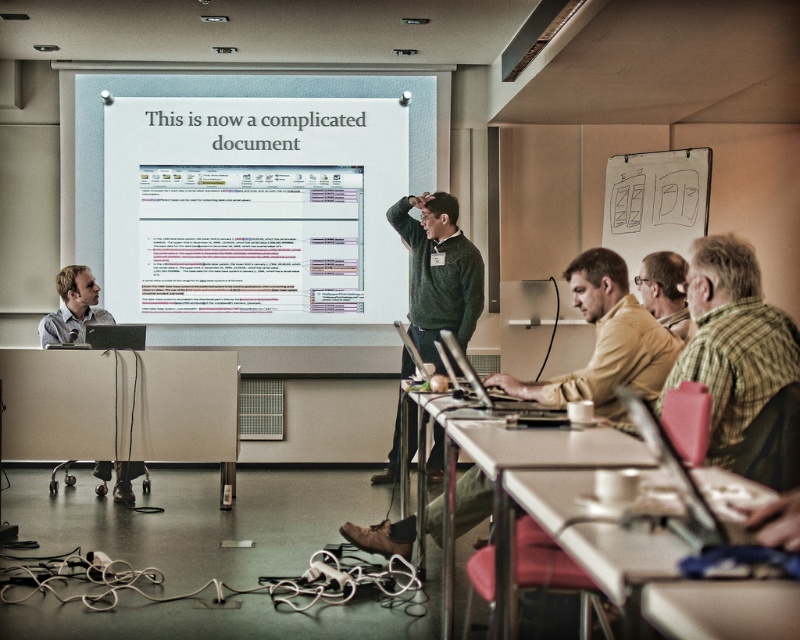
How much distance is there between matte plastic table at lower left and white paperboard at right?

A distance of 2.97 meters exists between matte plastic table at lower left and white paperboard at right.

Can you confirm if matte plastic table at lower left is taller than white paperboard at right?

Incorrect, matte plastic table at lower left's height is not larger of white paperboard at right's.

I want to click on matte plastic table at lower left, so click(121, 406).

Is beige plastic table at lower right to the right of black matte laptop at center from the viewer's perspective?

Indeed, beige plastic table at lower right is positioned on the right side of black matte laptop at center.

Which of these two, beige plastic table at lower right or black matte laptop at center, stands shorter?

black matte laptop at center

This screenshot has height=640, width=800. What are the coordinates of `beige plastic table at lower right` in the screenshot? It's located at (594, 531).

Is white glossy projection screen at upper center positioned before green checkered shirt at right?

No, white glossy projection screen at upper center is further to the viewer.

Who is lower down, white glossy projection screen at upper center or green checkered shirt at right?

green checkered shirt at right

Is point (364, 81) less distant than point (788, 320)?

That is False.

Where is `white glossy projection screen at upper center`? The image size is (800, 640). white glossy projection screen at upper center is located at coordinates (226, 96).